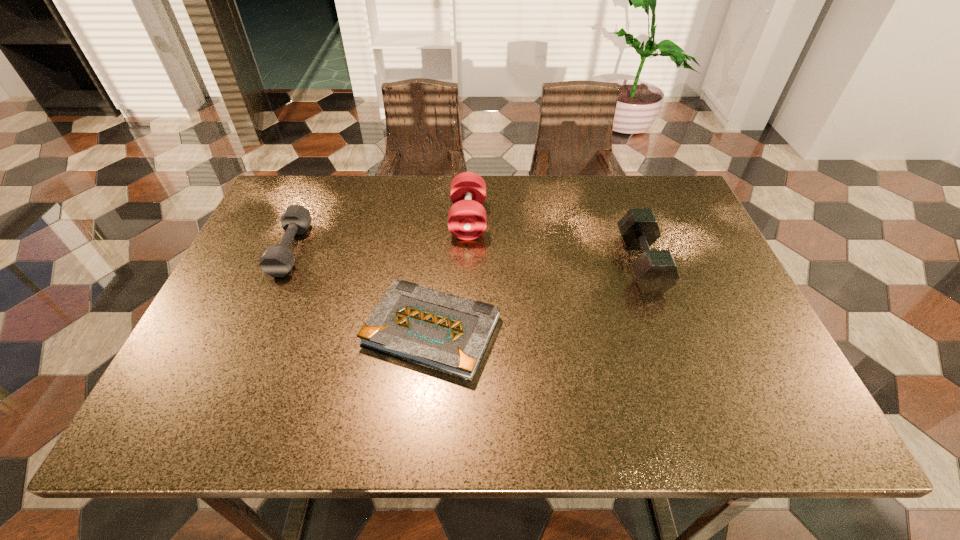
Where is `free space that is in between the rightmost object and the second dumbbell from right to left`? The image size is (960, 540). free space that is in between the rightmost object and the second dumbbell from right to left is located at coordinates (555, 241).

Find the location of `free space between the second dumbbell from right to left and the shortest object`. free space between the second dumbbell from right to left and the shortest object is located at coordinates (450, 275).

Locate an element on the screen. This screenshot has height=540, width=960. vacant space that's between the second dumbbell from left to right and the notebook is located at coordinates (450, 275).

Find the location of a particular element. Image resolution: width=960 pixels, height=540 pixels. blank region between the second dumbbell from right to left and the rightmost dumbbell is located at coordinates (555, 241).

Identify the location of unoccupied position between the second dumbbell from right to left and the shortest object. This screenshot has width=960, height=540. (450, 275).

You are a GUI agent. You are given a task and a screenshot of the screen. Output one action in this format:
    pyautogui.click(x=<x>, y=<y>)
    Task: Click on the vacant area that lies between the second dumbbell from left to right and the rightmost dumbbell
    The image size is (960, 540).
    Given the screenshot: What is the action you would take?
    pyautogui.click(x=555, y=241)

I want to click on vacant area that lies between the third tallest object and the second dumbbell from right to left, so click(x=380, y=234).

You are a GUI agent. You are given a task and a screenshot of the screen. Output one action in this format:
    pyautogui.click(x=<x>, y=<y>)
    Task: Click on the free space that is in between the rightmost dumbbell and the leftmost object
    
    Given the screenshot: What is the action you would take?
    pyautogui.click(x=467, y=256)

Where is `empty space between the notebook and the shortest dumbbell`? This screenshot has width=960, height=540. empty space between the notebook and the shortest dumbbell is located at coordinates (362, 290).

Where is `unoccupied area between the leftmost dumbbell and the shortest object`? unoccupied area between the leftmost dumbbell and the shortest object is located at coordinates (x=362, y=290).